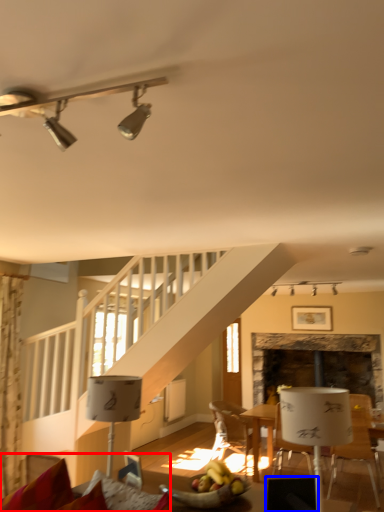
Question: Which point is closer to the camera, couch (highlighted by a red box) or armchair (highlighted by a blue box)?

Choices:
 (A) couch
 (B) armchair

Answer: (A)